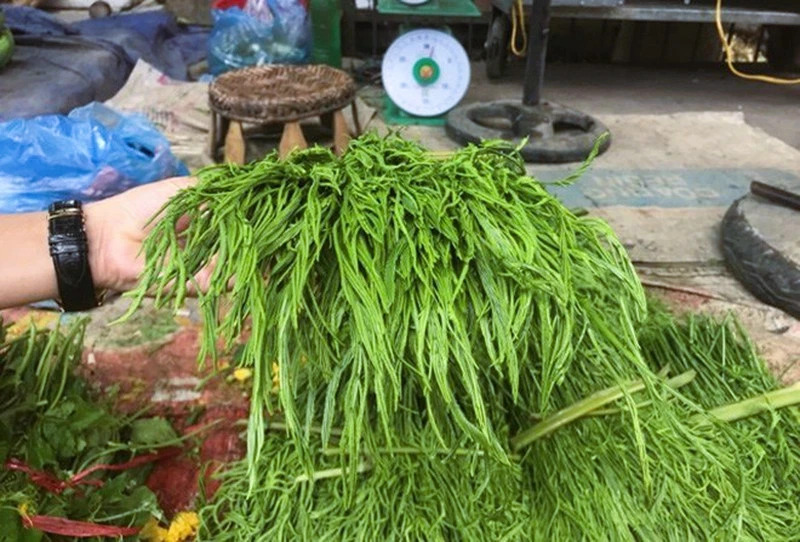
The height and width of the screenshot is (542, 800). What are the coordinates of `floor` in the screenshot? It's located at (650, 79).